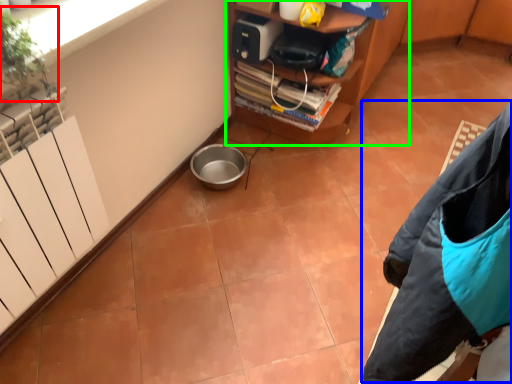
Question: Which object is the farthest from plant (highlighted by a red box)? Choose among these: jacket (highlighted by a blue box) or furniture (highlighted by a green box).

Choices:
 (A) jacket
 (B) furniture

Answer: (B)